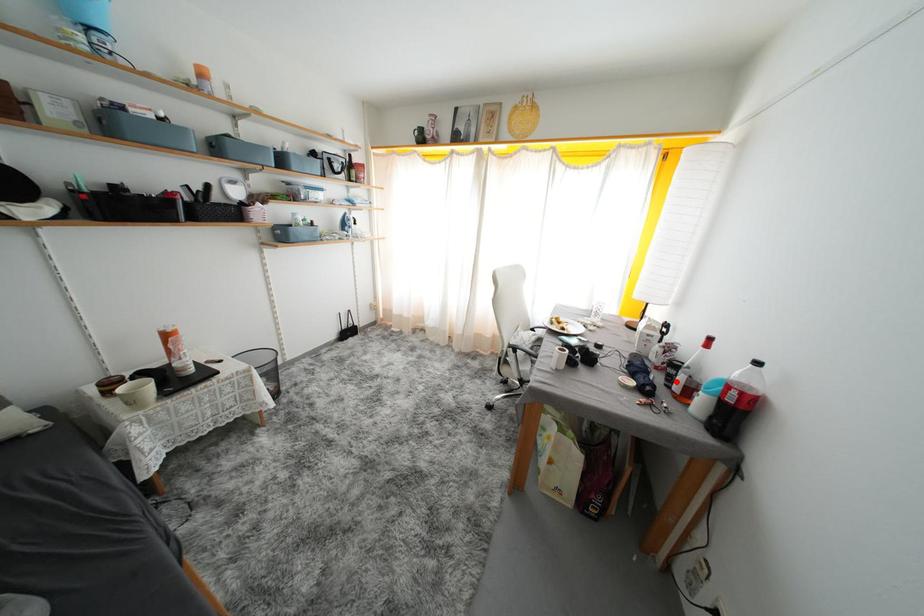
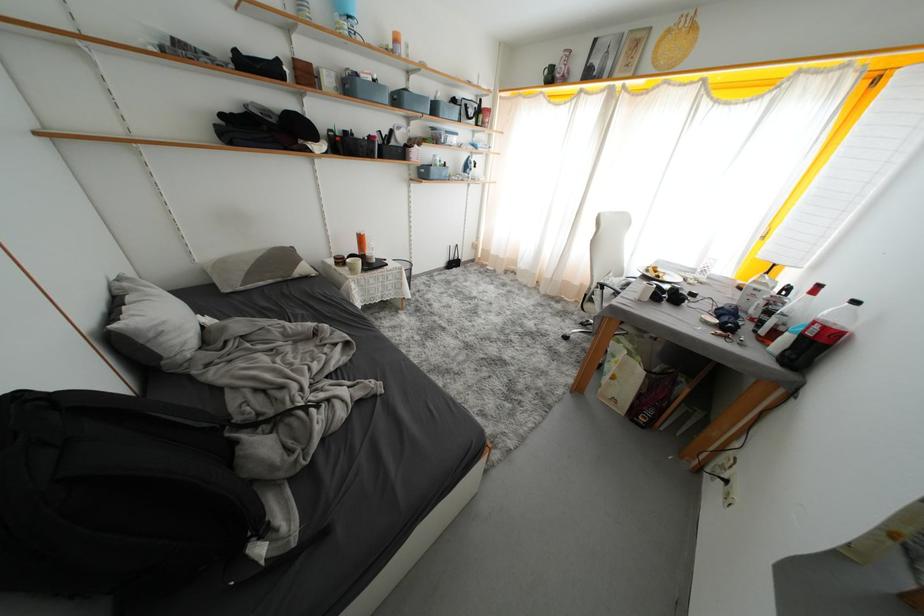
In the second image, find the point that corresponds to the highlighted location in the first image.

(767, 328)